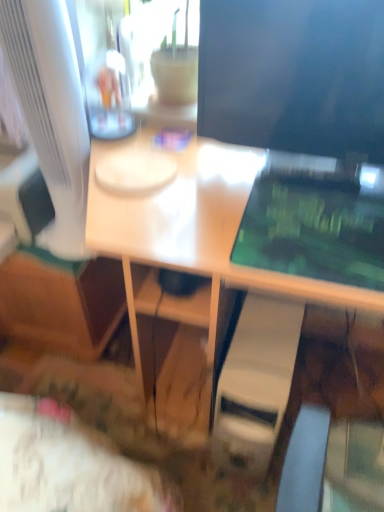
Question: Does matte black monitor at upper right, the second computer monitor when ordered from left to right, have a larger size compared to white plastic computer tower at lower center?

Choices:
 (A) no
 (B) yes

Answer: (A)

Question: Considering the relative sizes of matte black monitor at upper right, which appears as the first computer monitor when viewed from the right, and white plastic computer tower at lower center in the image provided, is matte black monitor at upper right, which appears as the first computer monitor when viewed from the right, smaller than white plastic computer tower at lower center?

Choices:
 (A) no
 (B) yes

Answer: (B)

Question: Does matte black monitor at upper right, the second computer monitor when ordered from left to right, contain white plastic computer tower at lower center?

Choices:
 (A) no
 (B) yes

Answer: (A)

Question: From the image's perspective, is matte black monitor at upper right, the second computer monitor when ordered from left to right, on top of white plastic computer tower at lower center?

Choices:
 (A) no
 (B) yes

Answer: (B)

Question: Considering the relative positions of matte black monitor at upper right, the second computer monitor when ordered from left to right, and white plastic computer tower at lower center in the image provided, is matte black monitor at upper right, the second computer monitor when ordered from left to right, behind white plastic computer tower at lower center?

Choices:
 (A) no
 (B) yes

Answer: (A)

Question: Could you tell me if matte black monitor at upper right, which appears as the first computer monitor when viewed from the right, is turned towards white plastic computer tower at lower center?

Choices:
 (A) yes
 (B) no

Answer: (B)

Question: Does white glossy desk at center have a larger size compared to white plastic computer tower at lower center?

Choices:
 (A) no
 (B) yes

Answer: (B)

Question: From a real-world perspective, does white glossy desk at center sit lower than white plastic computer tower at lower center?

Choices:
 (A) yes
 (B) no

Answer: (B)

Question: Can we say white glossy desk at center lies outside white plastic computer tower at lower center?

Choices:
 (A) yes
 (B) no

Answer: (A)

Question: From a real-world perspective, is white glossy desk at center positioned over white plastic computer tower at lower center based on gravity?

Choices:
 (A) no
 (B) yes

Answer: (B)

Question: Does white glossy desk at center have a smaller size compared to white plastic computer tower at lower center?

Choices:
 (A) no
 (B) yes

Answer: (A)

Question: Is white glossy desk at center wider than white plastic computer tower at lower center?

Choices:
 (A) no
 (B) yes

Answer: (B)

Question: Is white glossy computer monitor at left, positioned as the 1th computer monitor in left-to-right order, at the back of white glossy desk at center?

Choices:
 (A) no
 (B) yes

Answer: (A)